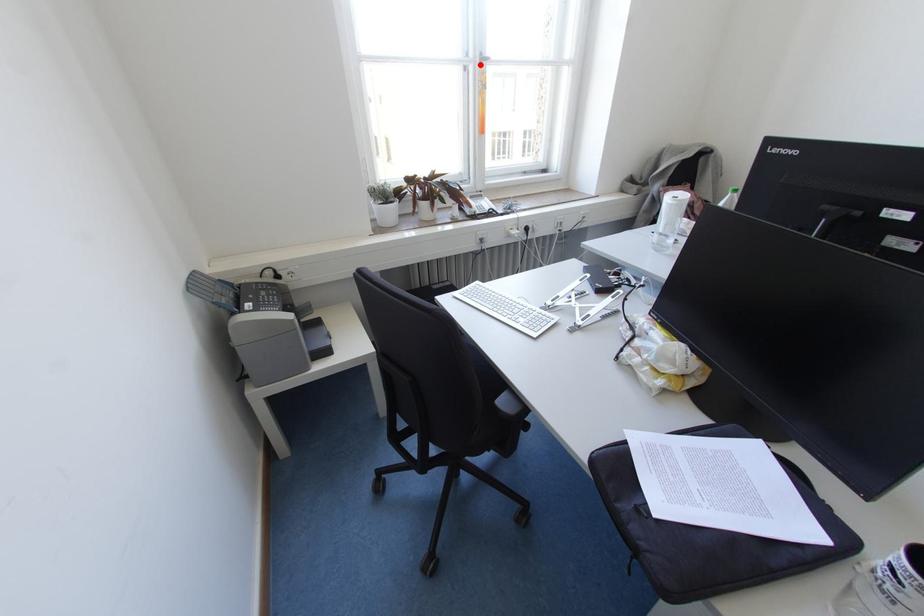
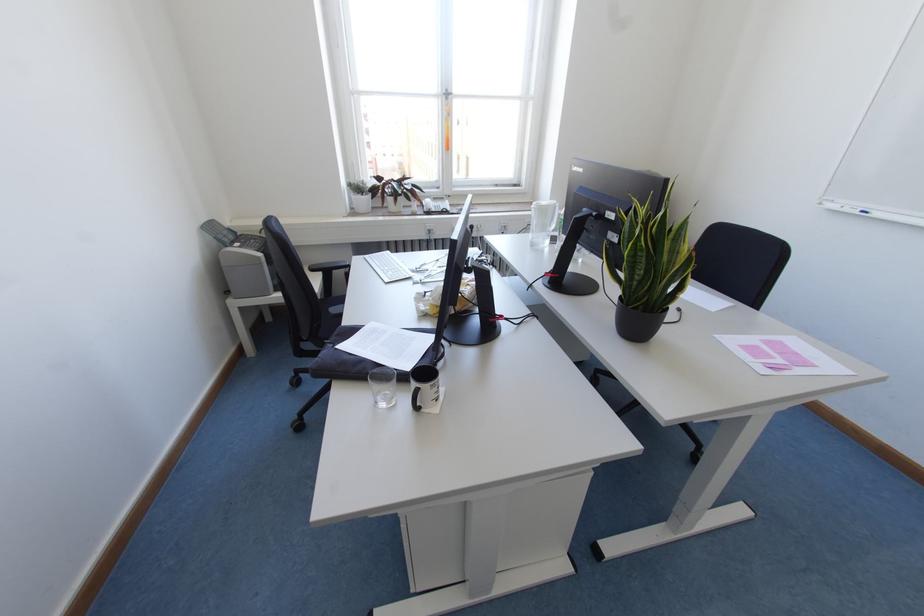
Locate, in the second image, the point that corresponds to the highlighted location in the first image.

(446, 98)